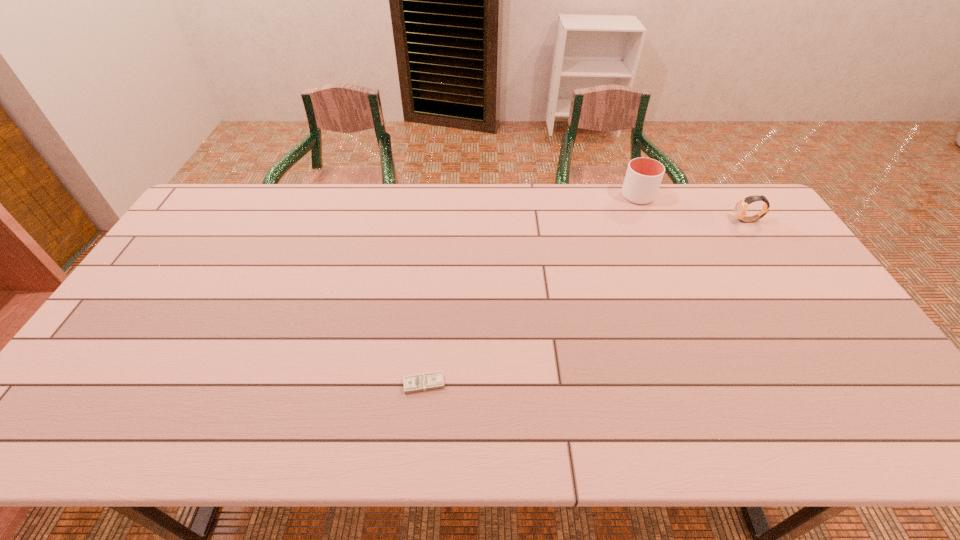
The image size is (960, 540). In order to click on the second object from left to right in this screenshot , I will do `click(643, 178)`.

This screenshot has width=960, height=540. In order to click on the tallest object in this screenshot , I will do `click(643, 178)`.

At what (x,y) coordinates should I click in order to perform the action: click on the second farthest object. Please return your answer as a coordinate pair (x, y). Looking at the image, I should click on (741, 206).

This screenshot has width=960, height=540. Identify the location of the rightmost object. (741, 206).

Identify the location of money. The image size is (960, 540). (434, 380).

This screenshot has height=540, width=960. I want to click on the shortest object, so click(434, 380).

This screenshot has width=960, height=540. In order to click on vacant space located 0.110m on the right of the second object from left to right in this screenshot , I will do `click(685, 196)`.

This screenshot has height=540, width=960. Identify the location of vacant region located on the face of the second farthest object. pyautogui.click(x=624, y=221).

Where is `blank area located on the face of the second farthest object`? The width and height of the screenshot is (960, 540). blank area located on the face of the second farthest object is located at coordinates (624, 221).

Locate an element on the screen. The width and height of the screenshot is (960, 540). free region located on the face of the second farthest object is located at coordinates (657, 221).